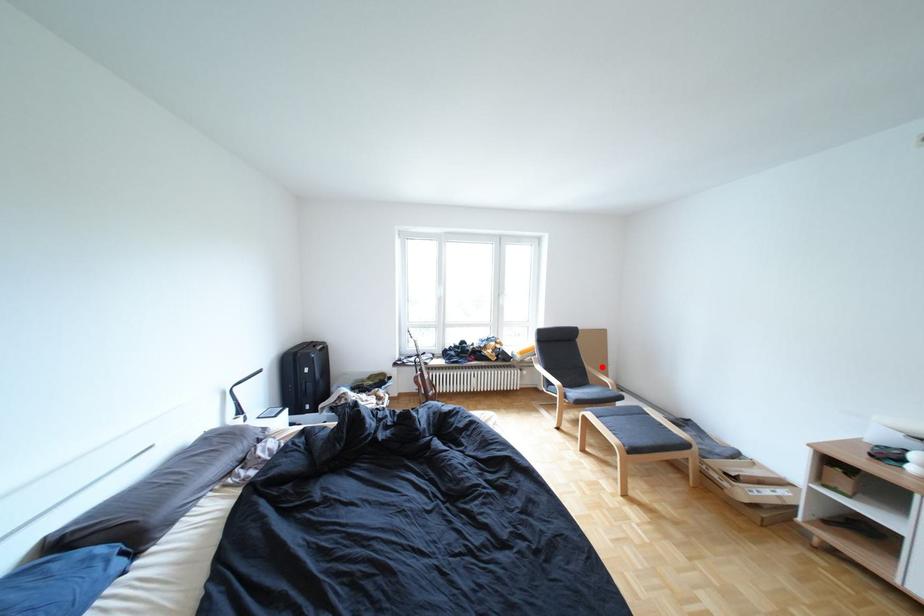
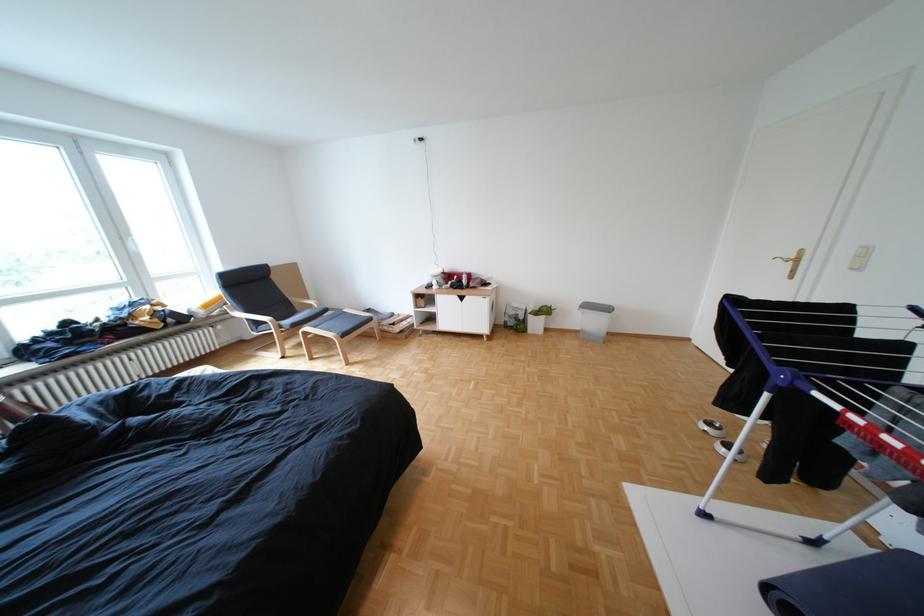
Find the pixel in the second image that matches the highlighted location in the first image.

(306, 299)